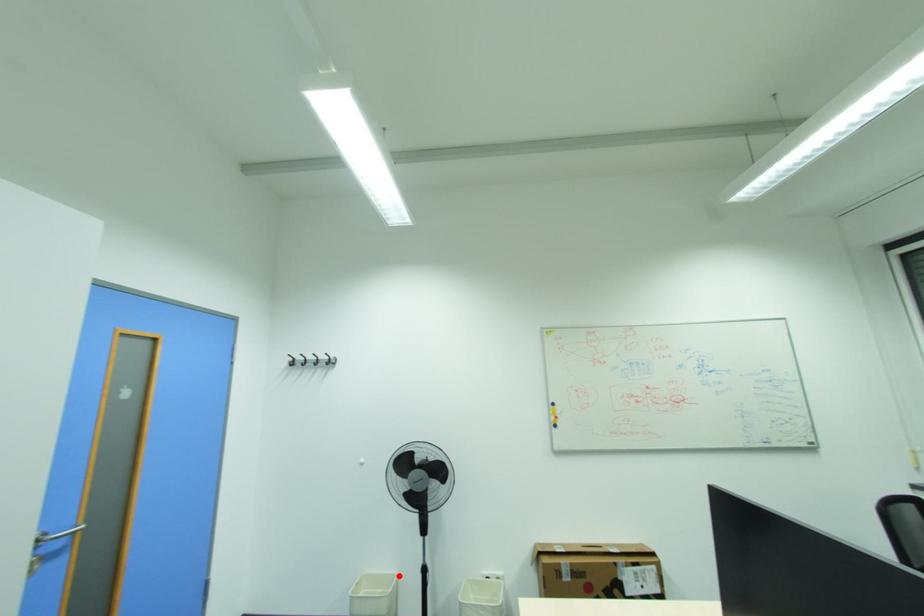
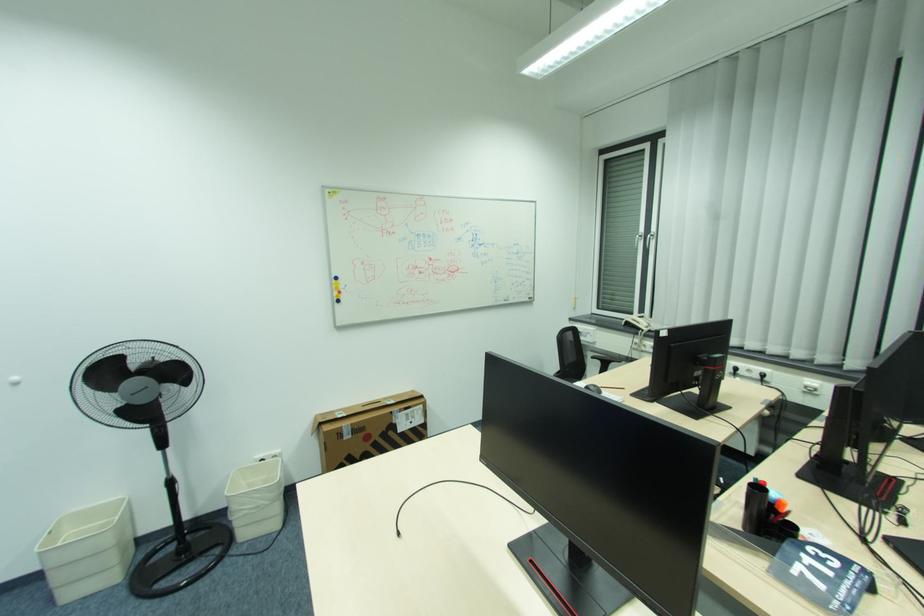
Question: I am providing you with two images of the same scene from different viewpoints. Given a red point in image1, look at the same physical point in image2. Is it:

Choices:
 (A) Closer to the viewpoint
 (B) Farther from the viewpoint

Answer: (A)